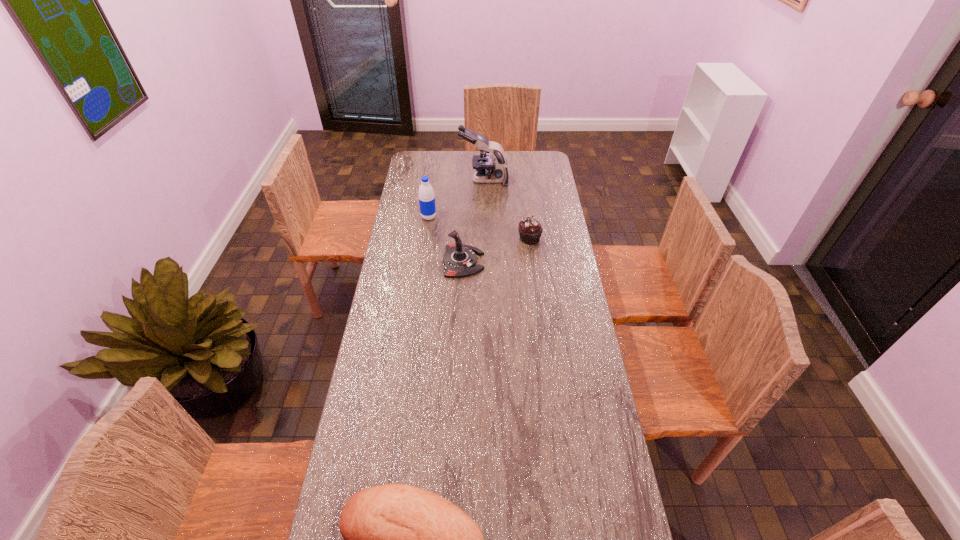
The width and height of the screenshot is (960, 540). Identify the location of vacant space that satisfies the following two spatial constraints: 1. on the front side of the cupcake; 2. on the handle side of the third shortest object. (533, 262).

Locate an element on the screen. The height and width of the screenshot is (540, 960). free region that satisfies the following two spatial constraints: 1. through the eyepieces of the cupcake; 2. on the right side of the microscope is located at coordinates (485, 239).